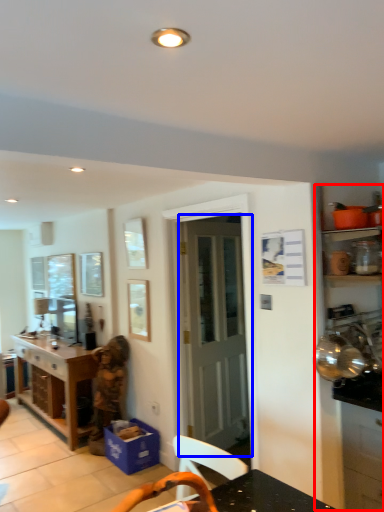
Question: Which object is closer to the camera taking this photo, dresser (highlighted by a red box) or door (highlighted by a blue box)?

Choices:
 (A) dresser
 (B) door

Answer: (A)